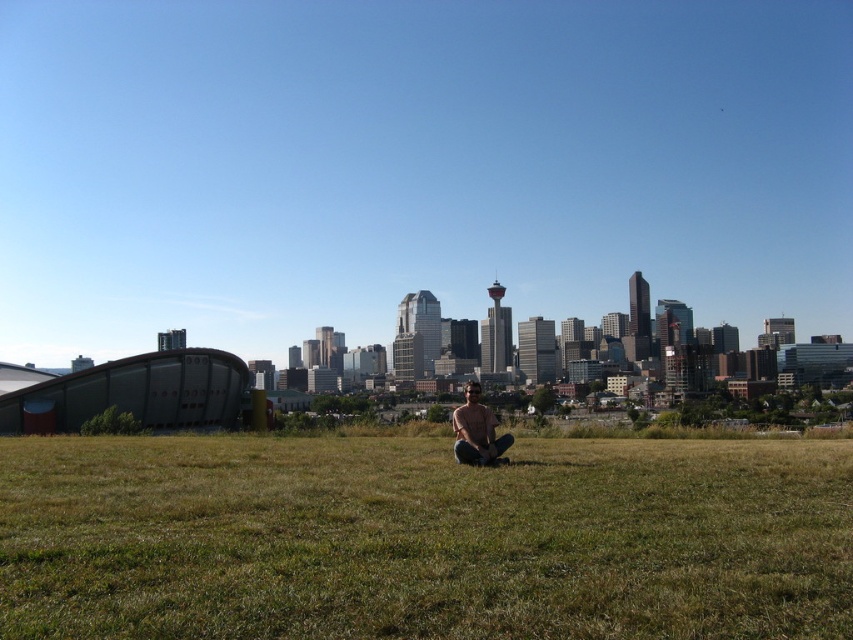
Question: Can you confirm if green grass at center is positioned above light brown skin at center?

Choices:
 (A) yes
 (B) no

Answer: (B)

Question: Does green grass at center come behind light brown skin at center?

Choices:
 (A) yes
 (B) no

Answer: (B)

Question: From the image, what is the correct spatial relationship of green grass at center in relation to light brown skin at center?

Choices:
 (A) right
 (B) left

Answer: (B)